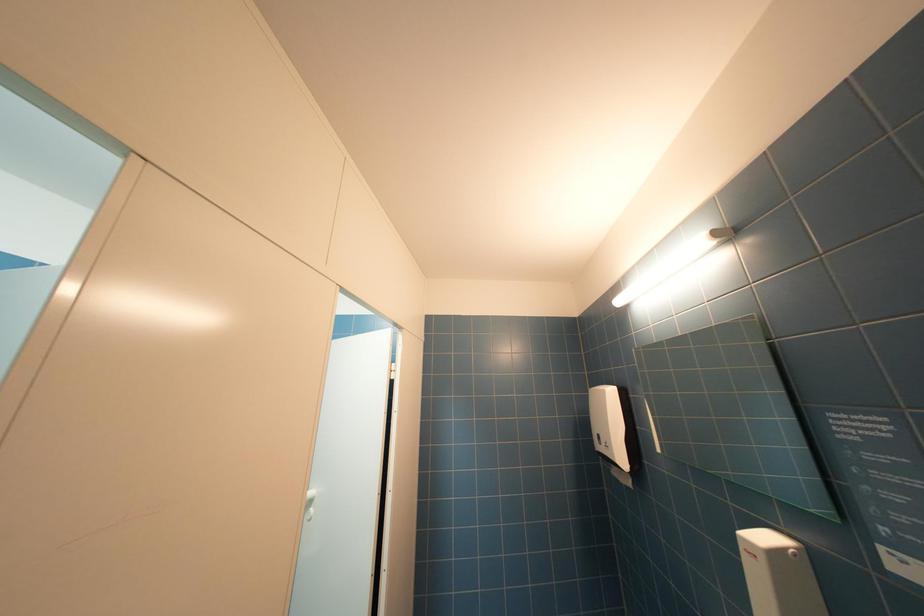
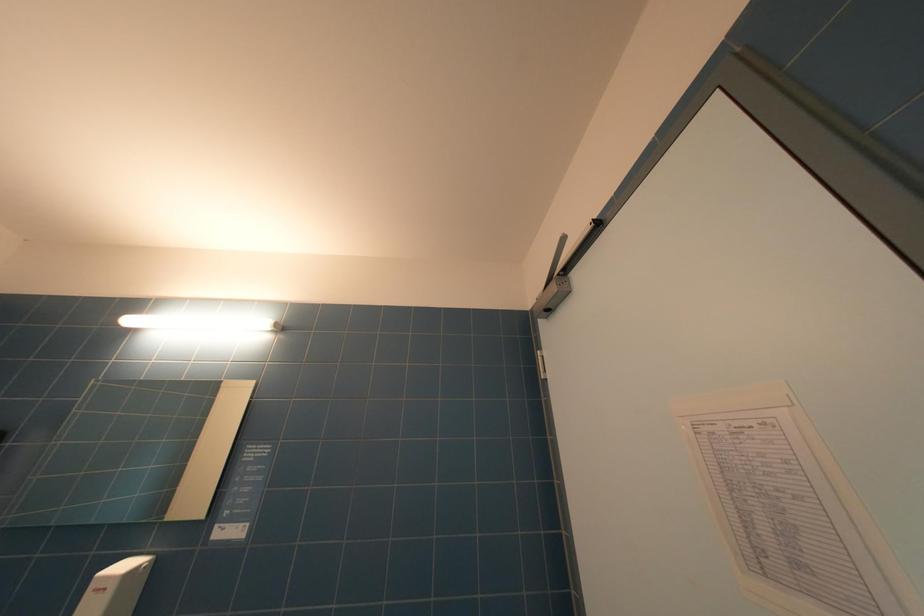
First-person continuous shooting, in which direction is the camera rotating?

The camera's rotation is toward right-up.